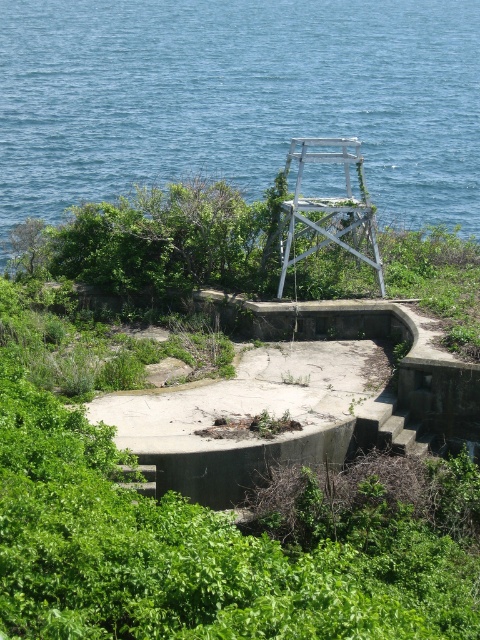
Between point (192, 166) and point (106, 572), which one is positioned behind?

Point (192, 166)

Can you confirm if blue water at upper center is bigger than green leafy vegetation at center?

Indeed, blue water at upper center has a larger size compared to green leafy vegetation at center.

Does point (435, 200) come closer to viewer compared to point (416, 531)?

No, (435, 200) is further to viewer.

I want to click on blue water at upper center, so click(x=238, y=99).